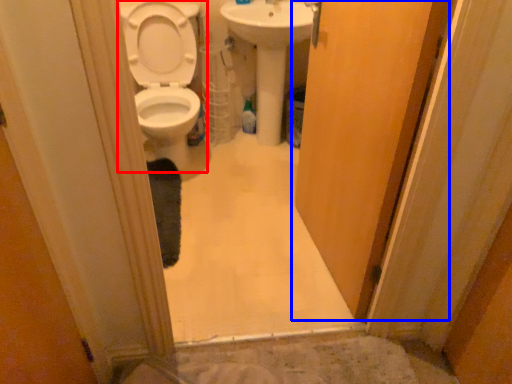
Question: Which of the following is the closest to the observer, toilet (highlighted by a red box) or door (highlighted by a blue box)?

Choices:
 (A) toilet
 (B) door

Answer: (B)